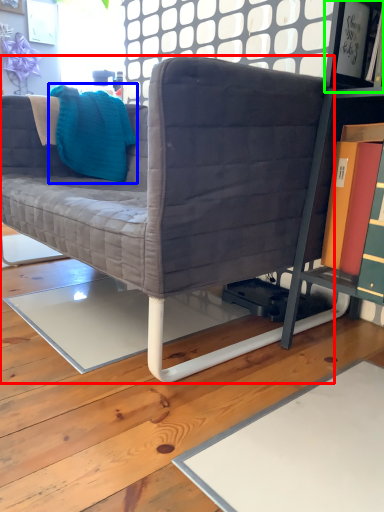
Question: Which is nearer to the studio couch (highlighted by a red box)? throw pillow (highlighted by a blue box) or shelf (highlighted by a green box).

Choices:
 (A) throw pillow
 (B) shelf

Answer: (A)